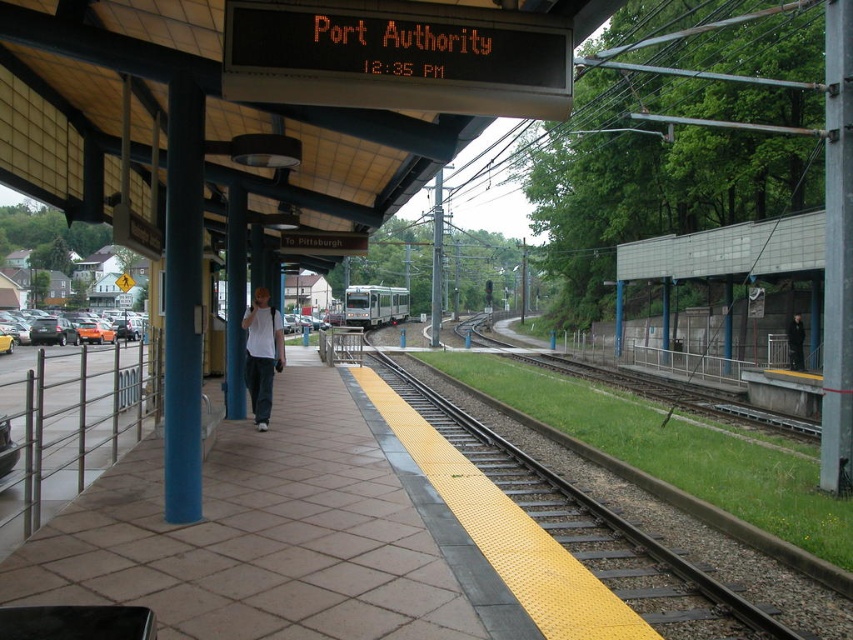
From the picture: You are standing on the platform at Port Authority station and see a person wearing a white matte shirt at center and a dark gray jacket at center. Which piece of clothing is closer to you?

The white matte shirt at center is closer to you because it is in front of the dark gray jacket at center.

You are standing on the platform at Port Authority station and see the brown tile platform at center and the dark gray jacket at center. Which object is positioned higher from the ground?

The dark gray jacket at center is higher than the brown tile platform at center because the brown tile platform at center is located below it.

You are a commuter on the platform and need to quickly identify two people based on their clothing. The first person is wearing a white matte shirt at center, and the second is wearing a dark gray jacket at center. Which clothing item takes up less visual space in the image?

The white matte shirt at center is smaller than the dark gray jacket at center, so the white matte shirt at center takes up less visual space in the image.